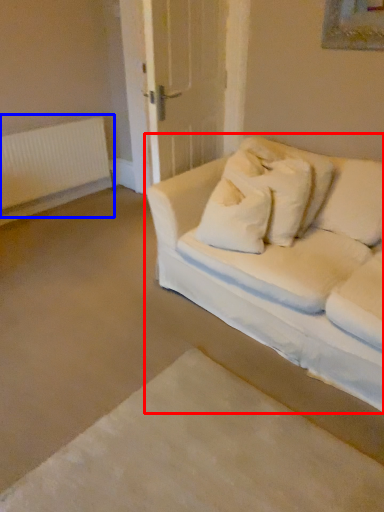
Question: Which object appears farthest to the camera in this image, studio couch (highlighted by a red box) or radiator (highlighted by a blue box)?

Choices:
 (A) studio couch
 (B) radiator

Answer: (B)